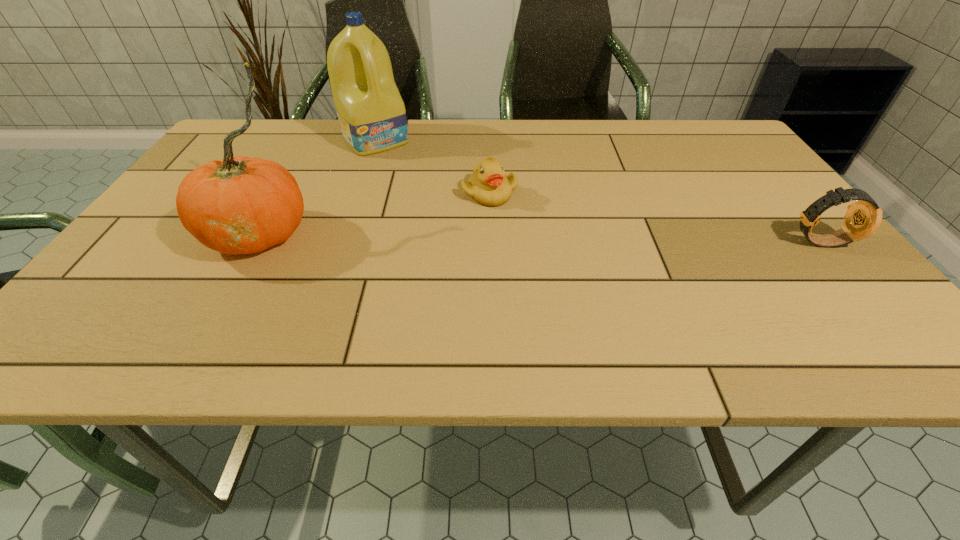
I want to click on free location at the near left corner, so click(x=162, y=314).

Where is `vacant space at the far right corner of the desktop`? vacant space at the far right corner of the desktop is located at coordinates (690, 156).

You are a GUI agent. You are given a task and a screenshot of the screen. Output one action in this format:
    pyautogui.click(x=<x>, y=<y>)
    Task: Click on the free space between the watch and the third object from left to right
    
    Given the screenshot: What is the action you would take?
    pyautogui.click(x=654, y=217)

Where is `unoccupied area between the pumpkin and the shortest object`? The width and height of the screenshot is (960, 540). unoccupied area between the pumpkin and the shortest object is located at coordinates (374, 213).

Where is `vacant area that lies between the detergent and the rightmost object`? vacant area that lies between the detergent and the rightmost object is located at coordinates coord(597,191).

Image resolution: width=960 pixels, height=540 pixels. In order to click on free space between the detergent and the third object from left to right in this screenshot , I will do `click(432, 166)`.

Identify the location of free space between the third object from left to right and the pumpkin. (374, 213).

Identify the location of vacant space that's between the watch and the detergent. (597, 191).

Find the location of a particular element. Image resolution: width=960 pixels, height=540 pixels. vacant space that is in between the shortest object and the detergent is located at coordinates (432, 166).

I want to click on free area in between the pumpkin and the third object from left to right, so click(x=374, y=213).